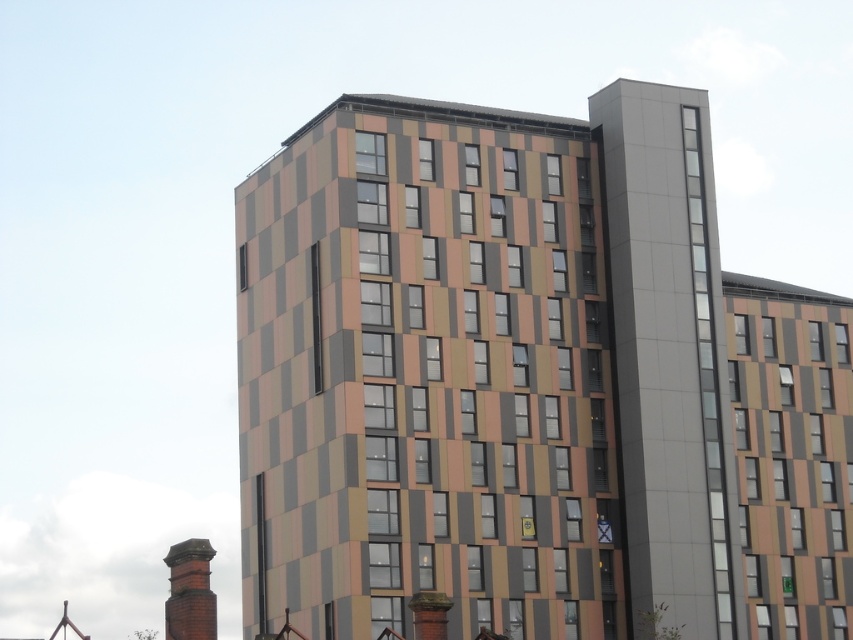
Based on the photo, can you confirm if smooth gray chimney at upper right is thinner than metallic rectangular clock at lower right?

No.

Who is taller, smooth gray chimney at upper right or metallic rectangular clock at lower right?

smooth gray chimney at upper right

Find the location of a particular element. This screenshot has width=853, height=640. smooth gray chimney at upper right is located at coordinates pos(669,355).

Can you confirm if smooth gray chimney at upper right is positioned to the left of red brick chimney at lower left?

In fact, smooth gray chimney at upper right is to the right of red brick chimney at lower left.

Does smooth gray chimney at upper right appear over red brick chimney at lower left?

Indeed, smooth gray chimney at upper right is positioned over red brick chimney at lower left.

This screenshot has width=853, height=640. What do you see at coordinates (669, 355) in the screenshot?
I see `smooth gray chimney at upper right` at bounding box center [669, 355].

Where is `smooth gray chimney at upper right`? smooth gray chimney at upper right is located at coordinates (669, 355).

Who is more distant from viewer, (x=264, y=278) or (x=628, y=109)?

Point (x=264, y=278)

Find the location of a particular element. The image size is (853, 640). multicolored textured building at center is located at coordinates (486, 369).